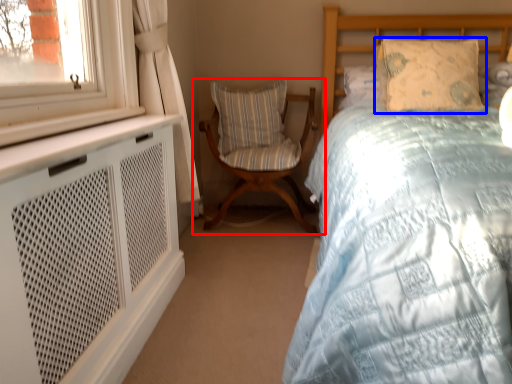
Question: Which object is closer to the camera taking this photo, chair (highlighted by a red box) or pillow (highlighted by a blue box)?

Choices:
 (A) chair
 (B) pillow

Answer: (B)